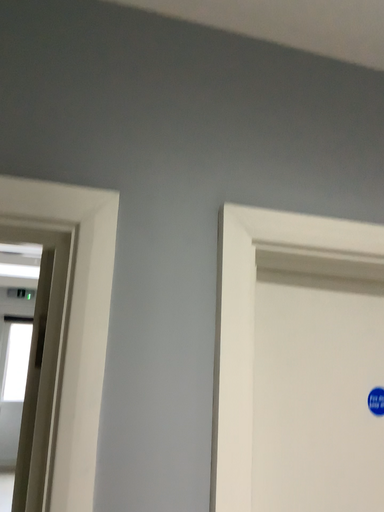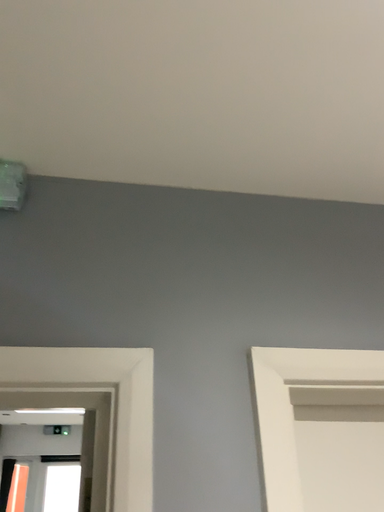
Question: How did the camera likely rotate when shooting the video?

Choices:
 (A) rotated upward
 (B) rotated downward

Answer: (A)